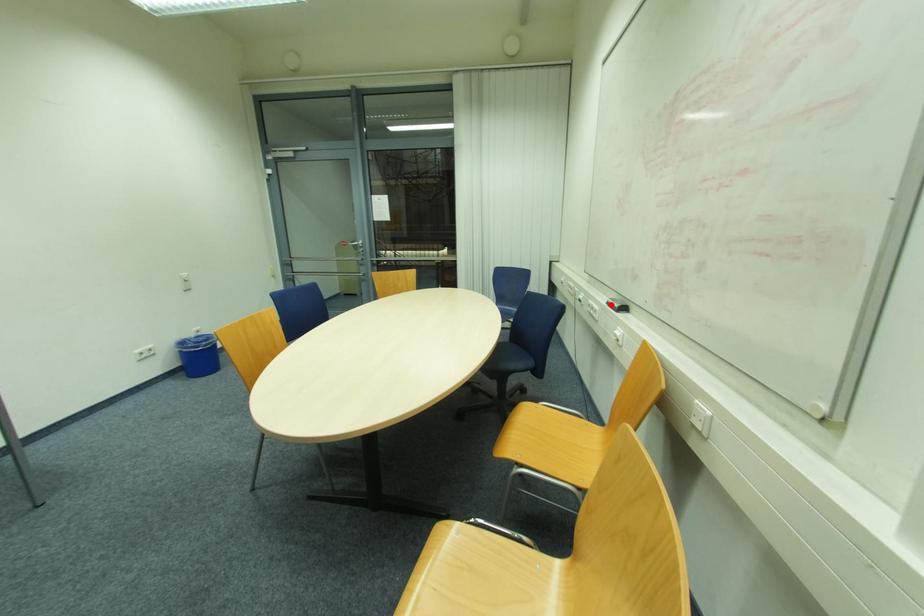
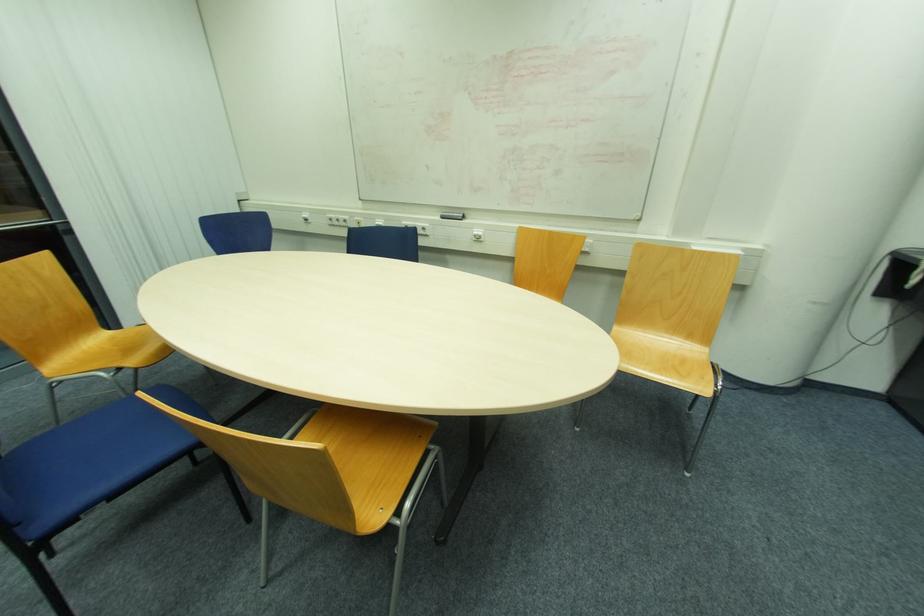
Question: I am providing you with two images of the same scene from different viewpoints. A red point is shown in image1. For the corresponding object point in image2, is it positioned nearer or farther from the camera?

Choices:
 (A) Nearer
 (B) Farther

Answer: (B)